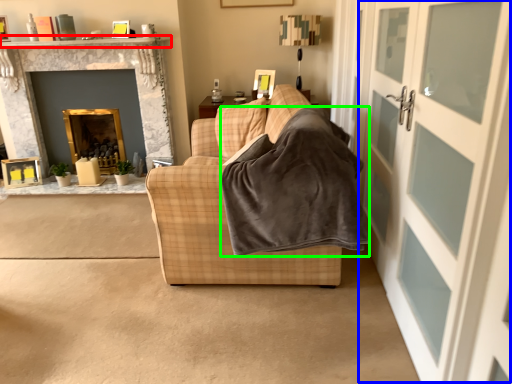
Question: Based on their relative distances, which object is farther from mantle (highlighted by a red box)? Choose from screen door (highlighted by a blue box) and blanket (highlighted by a green box).

Choices:
 (A) screen door
 (B) blanket

Answer: (A)